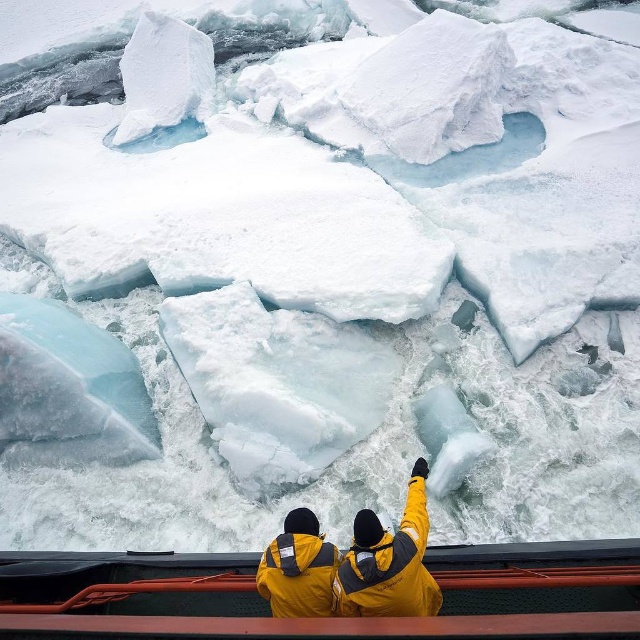
Question: Does yellow matte jacket at center have a larger size compared to orange metal rail at lower center?

Choices:
 (A) yes
 (B) no

Answer: (A)

Question: Is orange metal rail at lower center to the right of yellow matte jacket at lower center from the viewer's perspective?

Choices:
 (A) no
 (B) yes

Answer: (A)

Question: Which point is closer to the camera?

Choices:
 (A) yellow matte jacket at lower center
 (B) yellow matte jacket at center

Answer: (B)

Question: Which object appears farthest from the camera in this image?

Choices:
 (A) yellow matte jacket at lower center
 (B) orange metal rail at lower center

Answer: (B)

Question: Which object is positioned closest to the orange metal rail at lower center?

Choices:
 (A) yellow matte jacket at center
 (B) yellow matte jacket at lower center

Answer: (B)

Question: Observing the image, what is the correct spatial positioning of yellow matte jacket at center in reference to yellow matte jacket at lower center?

Choices:
 (A) above
 (B) below

Answer: (A)